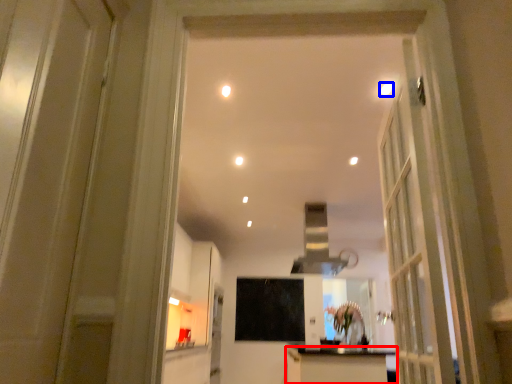
Question: Among these objects, which one is nearest to the camera, cabinetry (highlighted by a red box) or lighting (highlighted by a blue box)?

Choices:
 (A) cabinetry
 (B) lighting

Answer: (B)